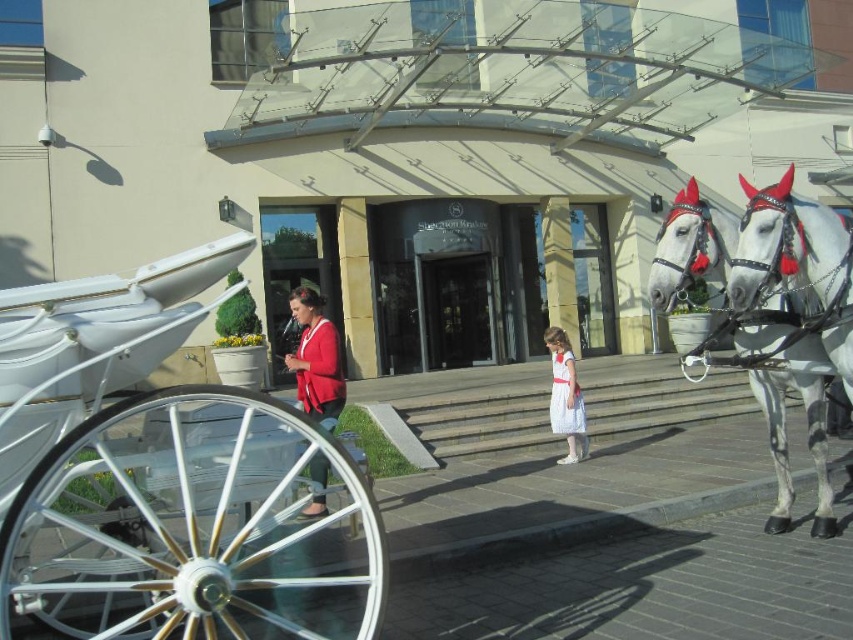
Question: Can you confirm if white speckled horse at right is thinner than matte red cardigan at center?

Choices:
 (A) yes
 (B) no

Answer: (B)

Question: Is white glossy horse at right above white satin dress at center?

Choices:
 (A) no
 (B) yes

Answer: (B)

Question: Which is nearer to the white satin dress at center?

Choices:
 (A) white polished wood horse cart at left
 (B) white glossy horse at right

Answer: (B)

Question: Does white polished wood horse cart at left appear on the left side of white speckled horse at right?

Choices:
 (A) yes
 (B) no

Answer: (A)

Question: Which object is farther from the camera taking this photo?

Choices:
 (A) white speckled horse at right
 (B) white satin dress at center
 (C) matte red cardigan at center

Answer: (B)

Question: Which point is closer to the camera?

Choices:
 (A) (300, 337)
 (B) (554, 410)

Answer: (B)